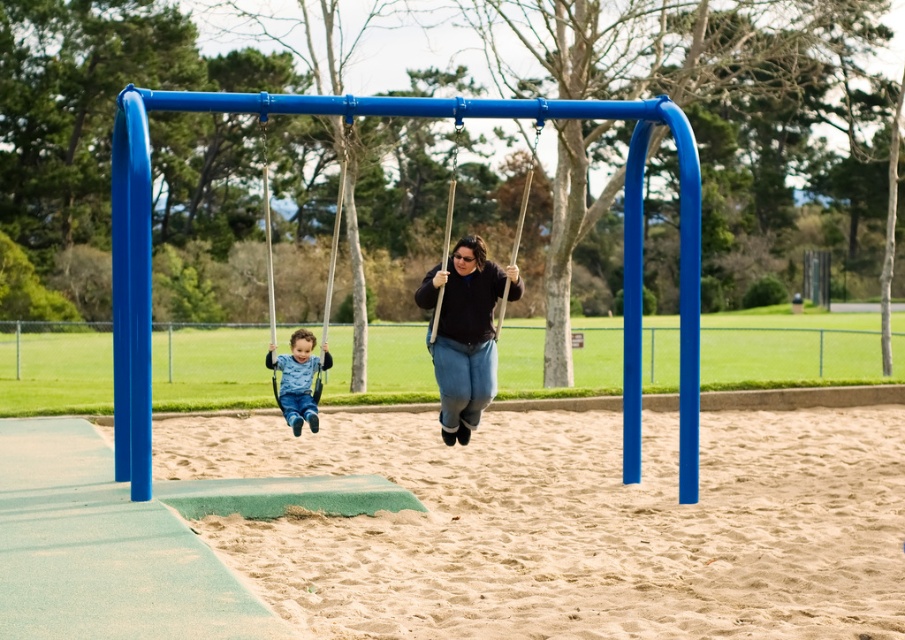
Between beige sandy ground at lower center and matte black swing at center, which one is positioned higher?

matte black swing at center

Which is more to the left, beige sandy ground at lower center or matte black swing at center?

Positioned to the left is matte black swing at center.

Describe the element at coordinates (573, 525) in the screenshot. I see `beige sandy ground at lower center` at that location.

You are a GUI agent. You are given a task and a screenshot of the screen. Output one action in this format:
    pyautogui.click(x=<x>, y=<y>)
    Task: Click on the beige sandy ground at lower center
    Image resolution: width=905 pixels, height=640 pixels.
    Given the screenshot: What is the action you would take?
    pyautogui.click(x=573, y=525)

Between point (481, 397) and point (437, 314), which one is positioned behind?

Positioned behind is point (481, 397).

Can you confirm if matte black sweater at center is wider than matte black swing at center?

No.

Locate an element on the screen. The image size is (905, 640). matte black sweater at center is located at coordinates (463, 333).

Image resolution: width=905 pixels, height=640 pixels. In order to click on matte black sweater at center in this screenshot , I will do `click(463, 333)`.

Who is positioned more to the left, beige sandy ground at lower center or matte blue swing at left?

matte blue swing at left is more to the left.

Between beige sandy ground at lower center and matte blue swing at left, which one is positioned higher?

Positioned higher is matte blue swing at left.

Locate an element on the screen. beige sandy ground at lower center is located at coordinates (573, 525).